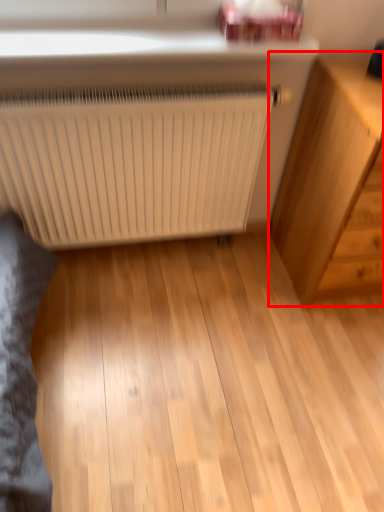
Question: From the image's perspective, considering the relative positions of chest of drawers (annotated by the red box) and radiator in the image provided, where is chest of drawers (annotated by the red box) located with respect to the staircase?

Choices:
 (A) above
 (B) below

Answer: (A)